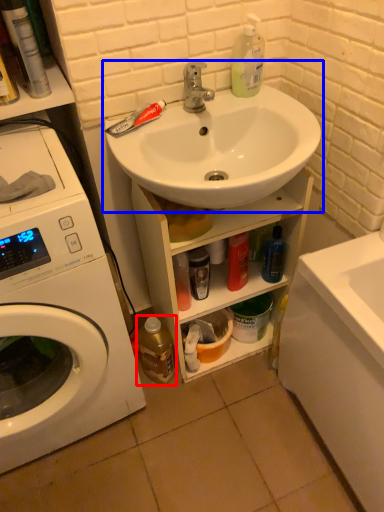
Question: Which of the following is the farthest to the observer, bottle (highlighted by a red box) or sink (highlighted by a blue box)?

Choices:
 (A) bottle
 (B) sink

Answer: (A)